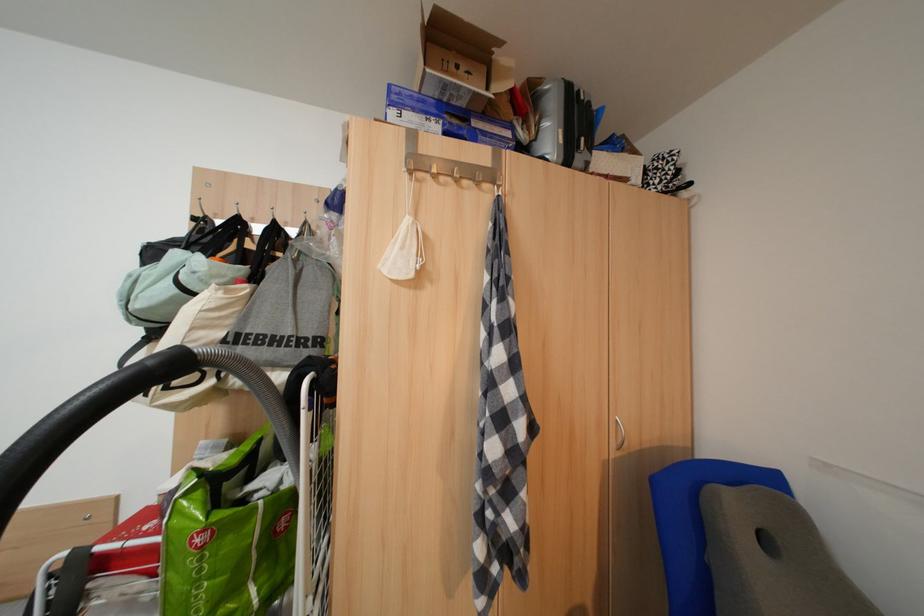
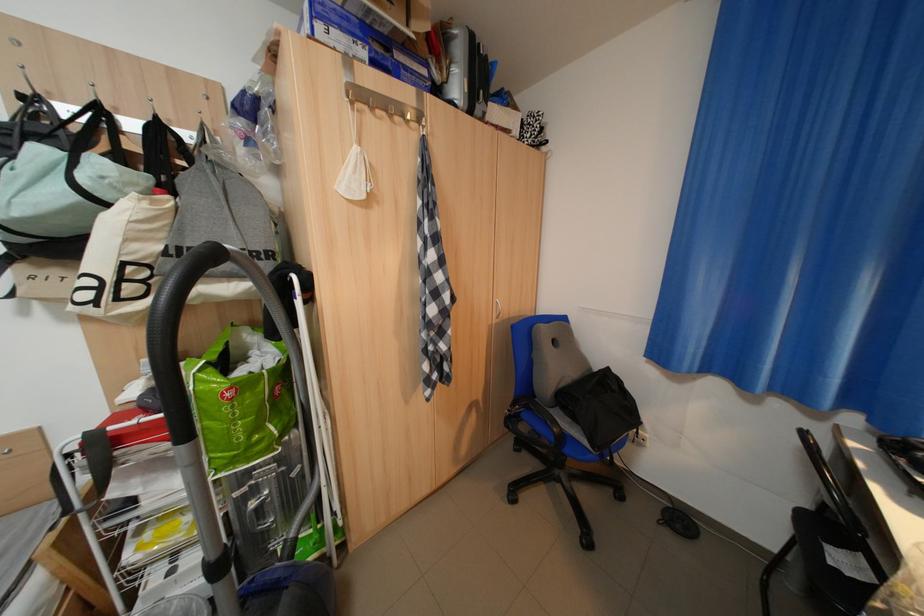
The images are taken continuously from a first-person perspective. In which direction are you moving?

The movement direction of the cameraman is left, backward.